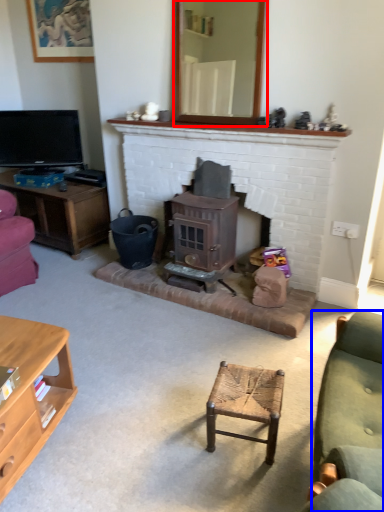
Question: Which point is closer to the camera, mirror (highlighted by a red box) or studio couch (highlighted by a blue box)?

Choices:
 (A) mirror
 (B) studio couch

Answer: (B)